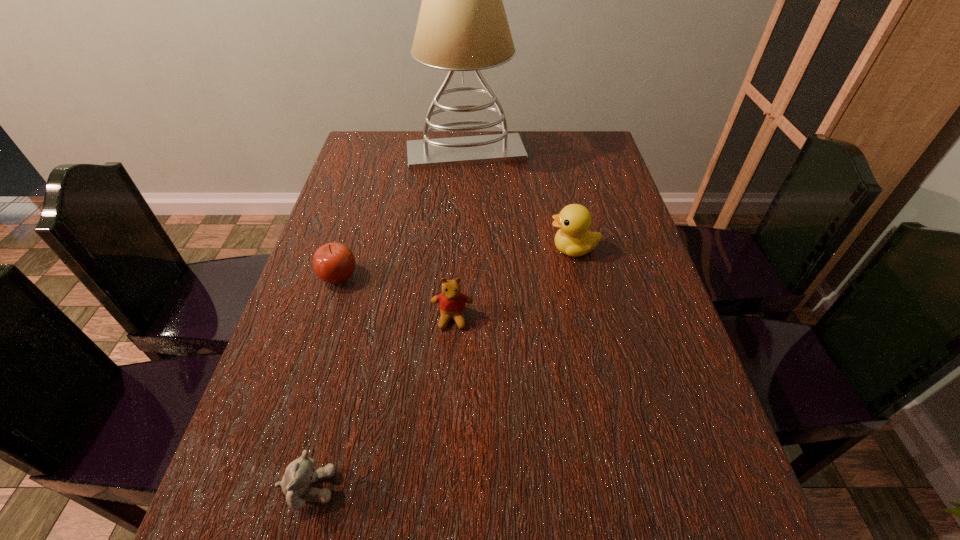
The image size is (960, 540). Find the location of `vacant space that's between the left teddy bear and the third nearest object`. vacant space that's between the left teddy bear and the third nearest object is located at coordinates (324, 382).

This screenshot has width=960, height=540. Identify the location of free space between the fourth farthest object and the tallest object. (459, 235).

You are a GUI agent. You are given a task and a screenshot of the screen. Output one action in this format:
    pyautogui.click(x=<x>, y=<y>)
    Task: Click on the vacant region between the shorter teddy bear and the second tallest object
    This screenshot has height=540, width=960.
    Given the screenshot: What is the action you would take?
    [x=441, y=368]

What are the coordinates of `free point between the tallest object and the fourth farthest object` in the screenshot? It's located at (459, 235).

Locate an element on the screen. The image size is (960, 540). vacant area between the left teddy bear and the apple is located at coordinates (324, 382).

Identify the location of object that is the fourth nearest to the shortest object. (462, 26).

Identify which object is the third nearest to the farthest object. Please provide its 2D coordinates. Your answer should be formatted as a tuple, i.e. [(x, y)], where the tuple contains the x and y coordinates of a point satisfying the conditions above.

[(452, 302)]

Where is `vacant space that satisfies the following two spatial constraints: 1. on the front-facing side of the fourth farthest object; 2. on the face of the left teddy bear`? The width and height of the screenshot is (960, 540). vacant space that satisfies the following two spatial constraints: 1. on the front-facing side of the fourth farthest object; 2. on the face of the left teddy bear is located at coordinates (444, 488).

Identify the location of free space that satisfies the following two spatial constraints: 1. on the front-facing side of the taller teddy bear; 2. on the face of the nearest object. (444, 488).

What are the coordinates of `vacant space that satisfies the following two spatial constraints: 1. on the face of the fourth nearest object; 2. on the front-facing side of the second nearest object` in the screenshot? It's located at (588, 318).